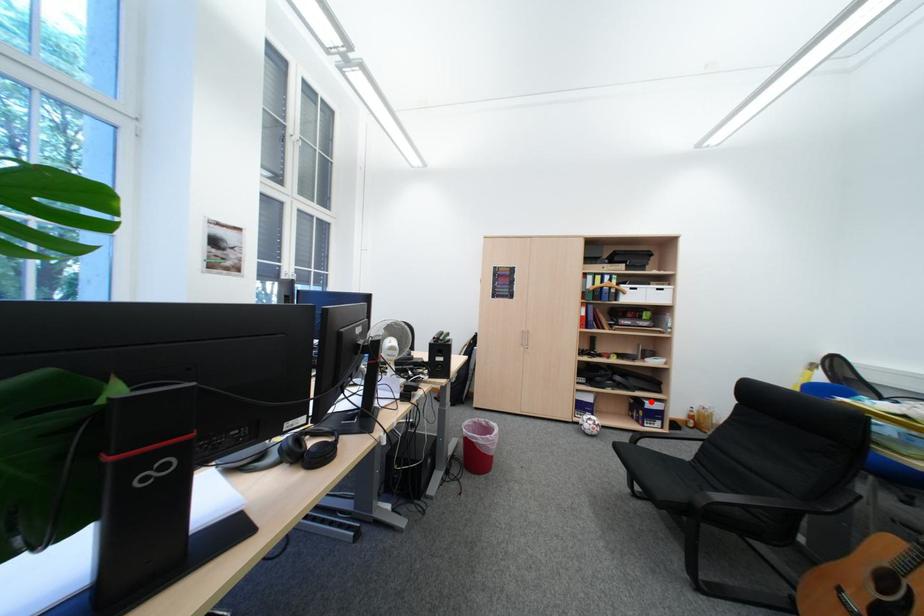
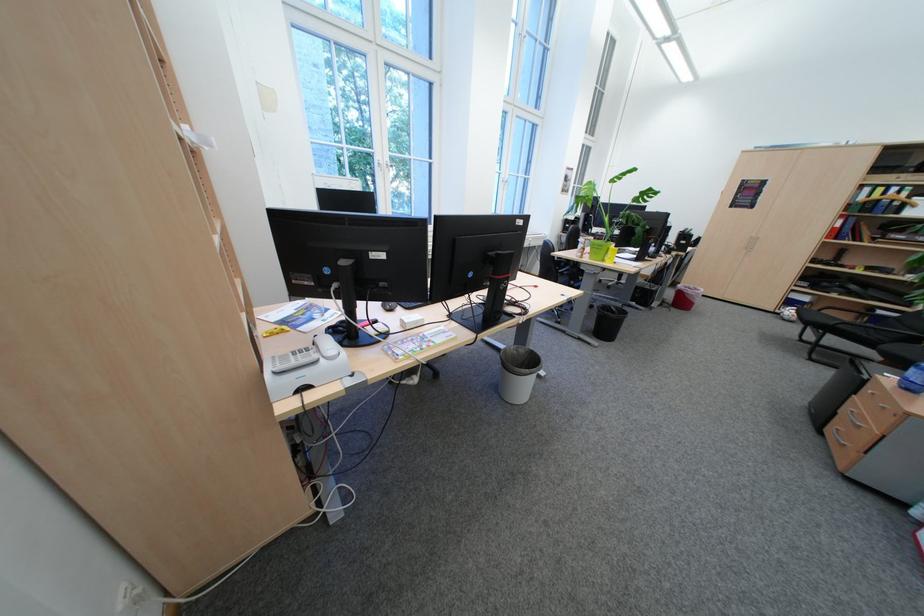
Question: I am providing you with two images of the same scene from different viewpoints. A red point is shown in image1. For the corresponding object point in image2, is it positioned nearer or farther from the camera?

Choices:
 (A) Nearer
 (B) Farther

Answer: (B)